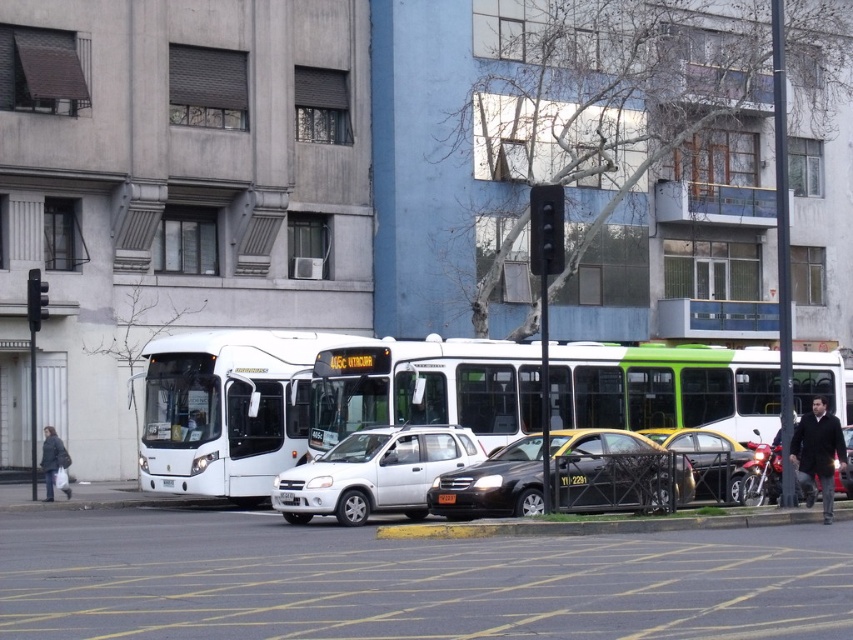
You are a pedestrian standing on the sidewalk and want to cross the street to reach the black asphalt curb at lower center. There is a black matte taxi at center blocking your path. Which direction should you walk around the taxi to reach the curb safely?

The black matte taxi at center is to the left of the black asphalt curb at lower center, so you should walk to the right of the taxi to reach the curb safely.

You are a pedestrian standing on the sidewalk and want to cross the street to reach the black asphalt curb at lower center. There is a black matte taxi at center blocking your path. Can you walk around the taxi to reach the curb?

The black matte taxi at center is located above black asphalt curb at lower center, which means the taxi is positioned in front of the curb from your perspective. To reach the curb, you would need to walk around the taxi either to the left or right side, as the curb is behind the taxi in this arrangement.

You are a delivery person trying to unload a large package from your truck. The truck is parked behind the white matte bus at center and the metallic silver car at right. Which vehicle should you move first to access the road?

The white matte bus at center is larger than the metallic silver car at right, so you should move the metallic silver car at right first to access the road since it is smaller and easier to maneuver around.